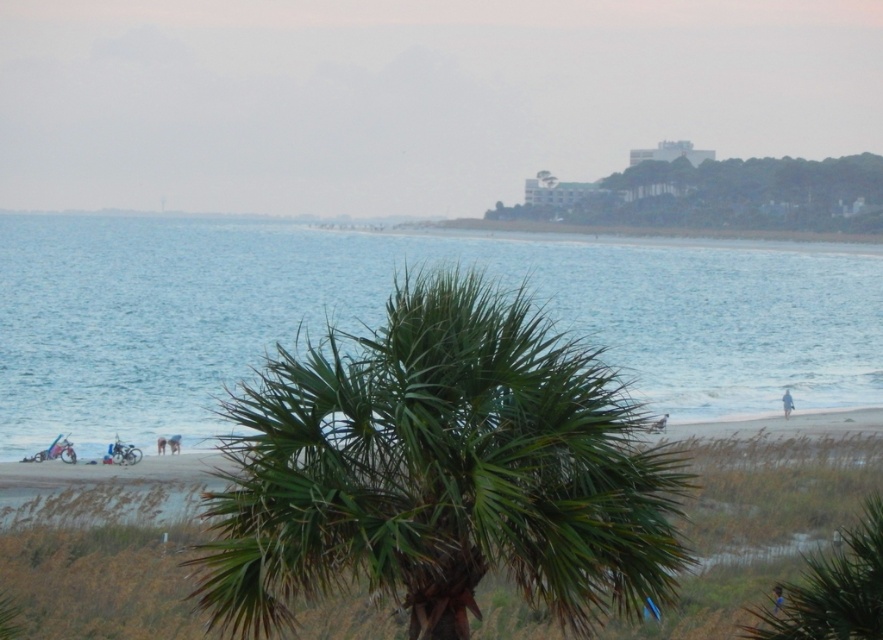
Measure the distance between green leafy palm tree at center and green leafy palm tree at upper right.

They are 169.22 meters apart.

Can you confirm if green leafy palm tree at center is positioned below green leafy palm tree at upper right?

Indeed, green leafy palm tree at center is positioned under green leafy palm tree at upper right.

Who is more forward, [442,458] or [774,173]?

Point [442,458] is in front.

Locate an element on the screen. green leafy palm tree at center is located at coordinates (440, 472).

Who is taller, blue water at center or light blue fabric at lower left?

Standing taller between the two is blue water at center.

Does blue water at center come in front of light blue fabric at lower left?

Yes, blue water at center is closer to the viewer.

At what (x,y) coordinates should I click in order to perform the action: click on blue water at center. Please return your answer as a coordinate pair (x, y). This screenshot has width=883, height=640. Looking at the image, I should click on click(383, 310).

Image resolution: width=883 pixels, height=640 pixels. Find the location of `light blue fabric at lower right`. light blue fabric at lower right is located at coordinates (786, 403).

Is light blue fabric at lower right wider than brown fabric pants at lower center?

Yes, light blue fabric at lower right is wider than brown fabric pants at lower center.

Between point (782, 400) and point (162, 440), which one is positioned in front?

Point (162, 440) is more forward.

Where is `light blue fabric at lower right`? The width and height of the screenshot is (883, 640). light blue fabric at lower right is located at coordinates coord(786,403).